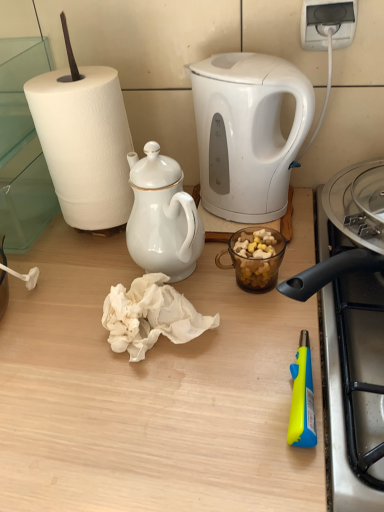
This screenshot has height=512, width=384. In order to click on white plastic power outlet at upper right in this screenshot , I will do `click(327, 23)`.

Where is `white crumpled paper towel at center`? white crumpled paper towel at center is located at coordinates (150, 316).

The height and width of the screenshot is (512, 384). I want to click on white porcelain teapot at upper center, so click(x=162, y=216).

Where is `white plastic power outlet at upper right`? white plastic power outlet at upper right is located at coordinates tap(327, 23).

Based on their positions, is white crumpled paper towel at center located to the left or right of wooden table at center?

From the image, it's evident that white crumpled paper towel at center is to the right of wooden table at center.

Is white crumpled paper towel at center positioned far away from wooden table at center?

No, white crumpled paper towel at center is not far from wooden table at center.

Between white crumpled paper towel at center and wooden table at center, which one has smaller size?

Smaller between the two is white crumpled paper towel at center.

Can you tell me how much white crumpled paper towel at center and wooden table at center differ in facing direction?

The angular difference between white crumpled paper towel at center and wooden table at center is 0.0274 degrees.

From the image's perspective, would you say white glossy electric kettle at upper center is positioned over wooden table at center?

Yes.

Which object is closer to the camera taking this photo, white glossy electric kettle at upper center or wooden table at center?

Positioned in front is wooden table at center.

Who is bigger, white glossy electric kettle at upper center or wooden table at center?

Bigger between the two is wooden table at center.

Is point (279, 102) closer to camera compared to point (65, 312)?

No, it is not.

Is wooden table at center not within white glossy electric kettle at upper center?

wooden table at center lies outside white glossy electric kettle at upper center's area.

From the image's perspective, which one is positioned higher, wooden table at center or white glossy electric kettle at upper center?

From the image's view, white glossy electric kettle at upper center is above.

Which is more to the left, wooden table at center or white glossy electric kettle at upper center?

From the viewer's perspective, wooden table at center appears more on the left side.

Looking at this image, are wooden table at center and white glossy electric kettle at upper center far apart?

No, there isn't a large distance between wooden table at center and white glossy electric kettle at upper center.

From a real-world perspective, is white plastic power outlet at upper right positioned above or below white crumpled paper towel at center?

white plastic power outlet at upper right is above white crumpled paper towel at center.

Would you say white crumpled paper towel at center is part of white plastic power outlet at upper right's contents?

Actually, white crumpled paper towel at center is outside white plastic power outlet at upper right.

Locate an element on the screen. This screenshot has width=384, height=512. power outlet located above the white crumpled paper towel at center (from the image's perspective) is located at coordinates (327, 23).

Is the surface of white plastic power outlet at upper right in direct contact with white crumpled paper towel at center?

white plastic power outlet at upper right and white crumpled paper towel at center are not in contact.

Is wooden table at center facing away from translucent glass mug at center?

No.

Based on their positions, is wooden table at center located to the left or right of translucent glass mug at center?

wooden table at center is positioned on translucent glass mug at center's left side.

Considering the points (290, 253) and (275, 239), which point is behind, point (290, 253) or point (275, 239)?

Positioned behind is point (290, 253).

From a real-world perspective, is wooden table at center positioned above or below translucent glass mug at center?

wooden table at center is situated lower than translucent glass mug at center in the real world.

Is translucent glass mug at center wider or thinner than white glossy electric kettle at upper center?

Clearly, translucent glass mug at center has less width compared to white glossy electric kettle at upper center.

How many degrees apart are the facing directions of translucent glass mug at center and white glossy electric kettle at upper center?

The angle between the facing direction of translucent glass mug at center and the facing direction of white glossy electric kettle at upper center is 0.00194 degrees.

Considering the relative positions of translucent glass mug at center and white glossy electric kettle at upper center in the image provided, is translucent glass mug at center to the left of white glossy electric kettle at upper center from the viewer's perspective?

No, translucent glass mug at center is not to the left of white glossy electric kettle at upper center.

Can white glossy electric kettle at upper center be found inside translucent glass mug at center?

No, translucent glass mug at center does not contain white glossy electric kettle at upper center.

Which object is further away from the camera, translucent glass mug at center or white crumpled paper towel at center?

translucent glass mug at center is more distant.

From the image's perspective, would you say translucent glass mug at center is shown under white crumpled paper towel at center?

No, from the image's perspective, translucent glass mug at center is not below white crumpled paper towel at center.

In terms of height, does translucent glass mug at center look taller or shorter compared to white crumpled paper towel at center?

translucent glass mug at center is taller than white crumpled paper towel at center.

Where is `paper towel in front of the translucent glass mug at center`? paper towel in front of the translucent glass mug at center is located at coordinates (150, 316).

Locate an element on the screen. The width and height of the screenshot is (384, 512). table that is under the white crumpled paper towel at center (from a real-world perspective) is located at coordinates (149, 393).

Locate an element on the screen. The image size is (384, 512). kettle behind the wooden table at center is located at coordinates (247, 133).

Considering their positions, is white crumpled paper towel at center positioned closer to white porcelain teapot at upper center than translucent glass mug at center?

white crumpled paper towel at center lies closer to white porcelain teapot at upper center than the other object.

Considering their positions, is white glossy electric kettle at upper center positioned further to translucent glass mug at center than white plastic power outlet at upper right?

white plastic power outlet at upper right is further to translucent glass mug at center.

Estimate the real-world distances between objects in this image. Which object is further from white crumpled paper towel at center, white glossy electric kettle at upper center or white plastic power outlet at upper right?

The object further to white crumpled paper towel at center is white plastic power outlet at upper right.

When comparing their distances from white crumpled paper towel at center, does white plastic power outlet at upper right or white glossy electric kettle at upper center seem closer?

Based on the image, white glossy electric kettle at upper center appears to be nearer to white crumpled paper towel at center.

Which object lies nearer to the anchor point white plastic power outlet at upper right, white glossy electric kettle at upper center or translucent glass mug at center?

Among the two, white glossy electric kettle at upper center is located nearer to white plastic power outlet at upper right.

Considering their positions, is white crumpled paper towel at center positioned further to translucent glass mug at center than white porcelain teapot at upper center?

Based on the image, white crumpled paper towel at center appears to be further to translucent glass mug at center.

Based on their spatial positions, is white glossy electric kettle at upper center or white porcelain teapot at upper center further from white crumpled paper towel at center?

white glossy electric kettle at upper center.

Based on their spatial positions, is white porcelain teapot at upper center or white plastic power outlet at upper right further from wooden table at center?

The object further to wooden table at center is white plastic power outlet at upper right.

You are a GUI agent. You are given a task and a screenshot of the screen. Output one action in this format:
    pyautogui.click(x=<x>, y=<y>)
    Task: Click on the kettle between white plastic power outlet at upper right and wooden table at center in the vertical direction
    
    Given the screenshot: What is the action you would take?
    pyautogui.click(x=247, y=133)

This screenshot has height=512, width=384. Identify the location of paper towel between white plastic power outlet at upper right and wooden table at center in the up-down direction. (150, 316).

At what (x,y) coordinates should I click in order to perform the action: click on teapot between white crumpled paper towel at center and translucent glass mug at center from left to right. Please return your answer as a coordinate pair (x, y). Looking at the image, I should click on (162, 216).

At what (x,y) coordinates should I click in order to perform the action: click on teapot between white plastic power outlet at upper right and wooden table at center from top to bottom. Please return your answer as a coordinate pair (x, y). Looking at the image, I should click on (162, 216).